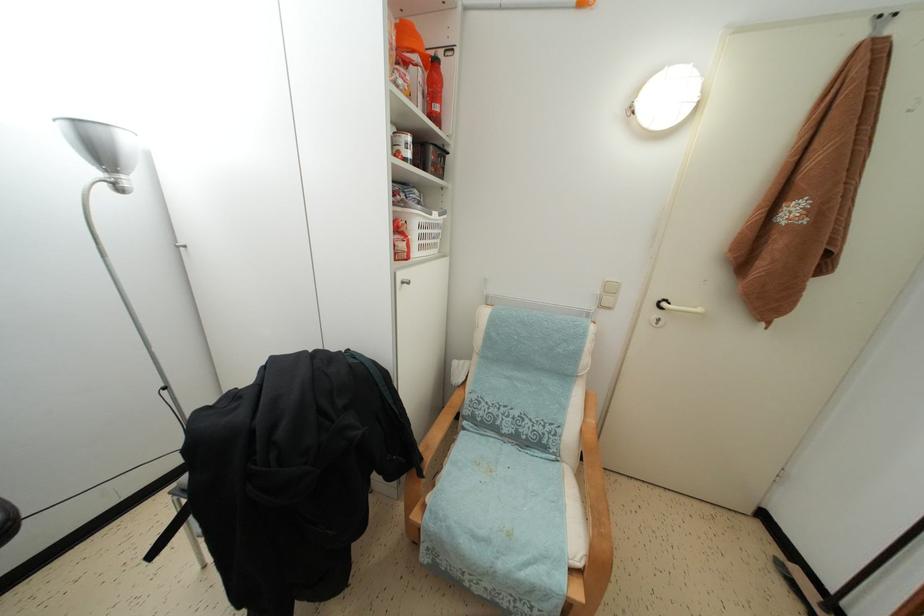
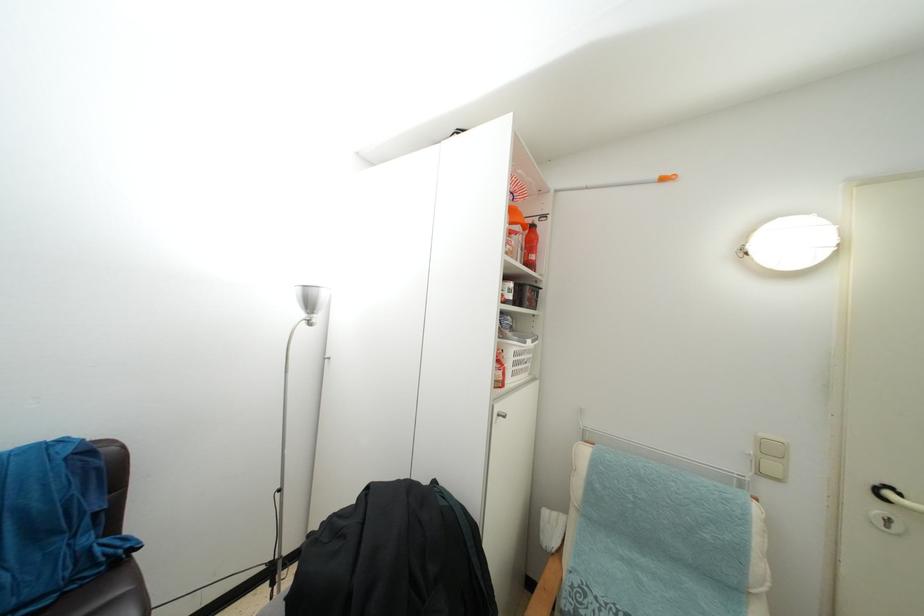
The first image is from the beginning of the video and the second image is from the end. How did the camera likely rotate when shooting the video?

The rotation direction of the camera is left-up.